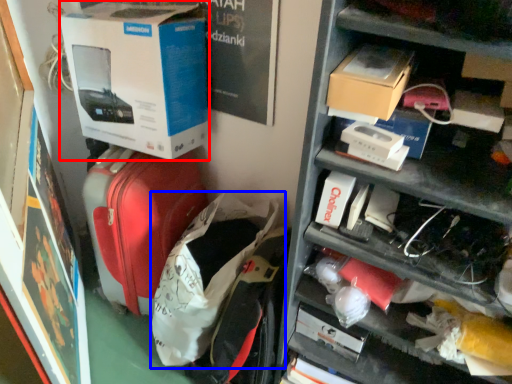
Question: Which object appears closest to the camera in this image, box (highlighted by a red box) or luggage (highlighted by a blue box)?

Choices:
 (A) box
 (B) luggage

Answer: (B)